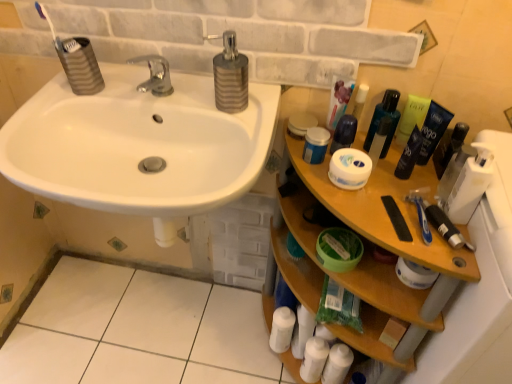
Locate an element on the screen. The image size is (512, 384). free space that is in between silver metallic faucet at center and silver metallic soap dispenser at upper center is located at coordinates (196, 104).